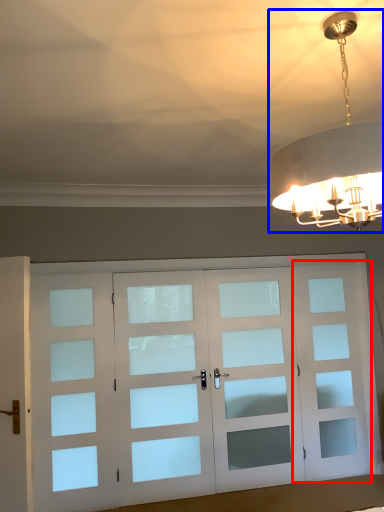
Question: Which of the following is the closest to the observer, screen door (highlighted by a red box) or lamp (highlighted by a blue box)?

Choices:
 (A) screen door
 (B) lamp

Answer: (B)